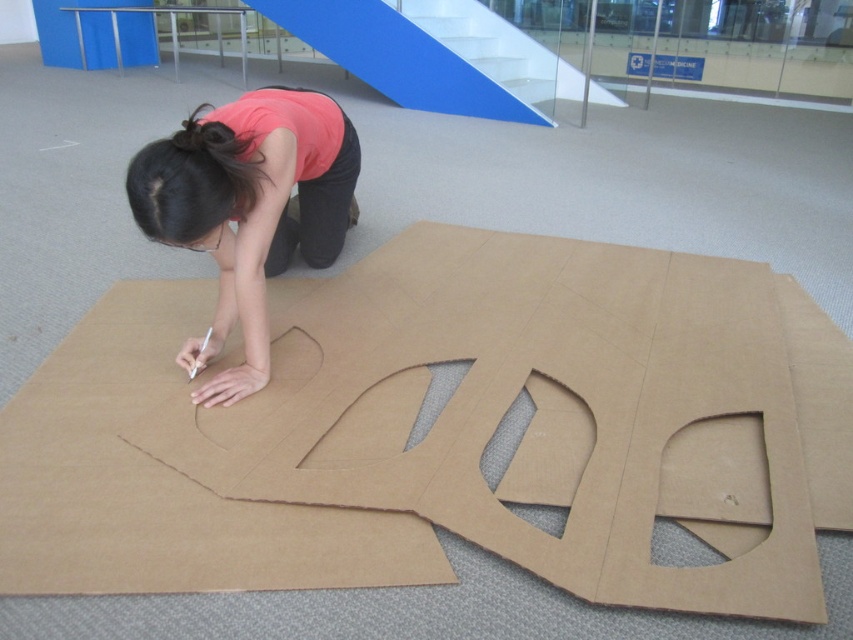
Question: Is pink matte shirt at center behind black hair at upper center?

Choices:
 (A) yes
 (B) no

Answer: (B)

Question: Which object appears closest to the camera in this image?

Choices:
 (A) brown cardboard at center
 (B) black hair at upper center

Answer: (A)

Question: Which of the following is the farthest from the observer?

Choices:
 (A) (213, 253)
 (B) (206, 122)

Answer: (A)

Question: Is brown cardboard at center behind pink matte shirt at center?

Choices:
 (A) no
 (B) yes

Answer: (A)

Question: In this image, where is pink matte shirt at center located relative to black hair at upper center?

Choices:
 (A) left
 (B) right

Answer: (B)

Question: Which point is closer to the camera?

Choices:
 (A) (285, 196)
 (B) (207, 166)
 (C) (331, 413)

Answer: (B)